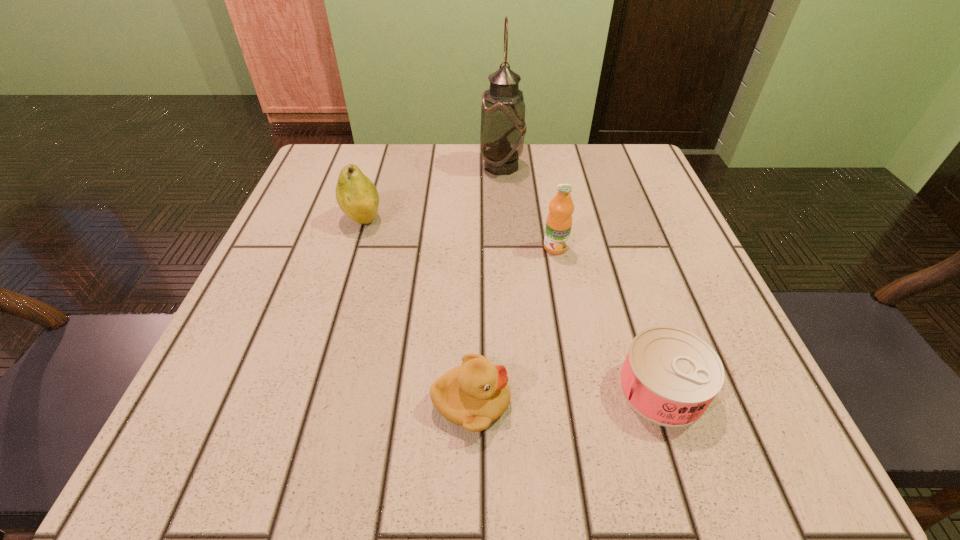
In order to click on oil lamp in this screenshot , I will do `click(503, 127)`.

Locate an element on the screen. Image resolution: width=960 pixels, height=540 pixels. the farthest object is located at coordinates (503, 127).

Locate an element on the screen. This screenshot has width=960, height=540. the fourth nearest object is located at coordinates (356, 195).

Find the location of a particular element. Image resolution: width=960 pixels, height=540 pixels. pear is located at coordinates (356, 195).

Locate an element on the screen. Image resolution: width=960 pixels, height=540 pixels. orange juice is located at coordinates (559, 220).

I want to click on the fourth object from left to right, so click(559, 220).

Locate an element on the screen. Image resolution: width=960 pixels, height=540 pixels. duckling is located at coordinates (473, 395).

Locate an element on the screen. the rightmost object is located at coordinates 670,376.

Image resolution: width=960 pixels, height=540 pixels. Identify the location of the shortest object. (670, 376).

What are the coordinates of `vacant region located 0.200m on the front of the tallest object` in the screenshot? It's located at [507, 238].